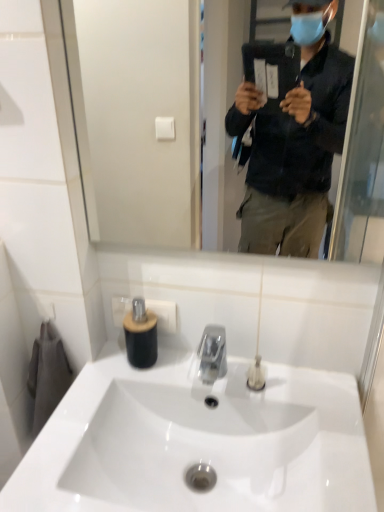
Identify the location of vacant space to the left of black matte soap dispenser at center, which is counted as the 1th toiletry, starting from the left. (101, 367).